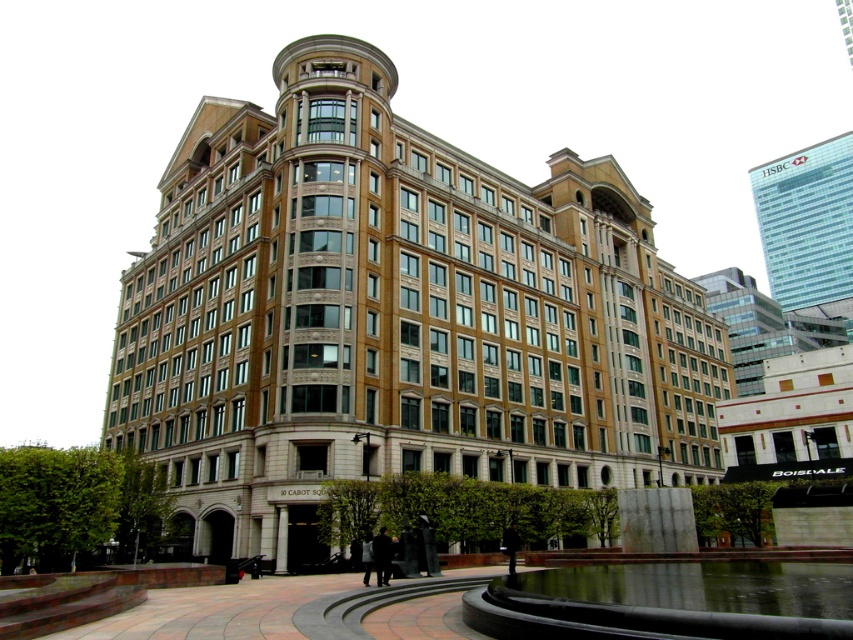
You are a drone operator who needs to fly a drone between the brown stone building at center and the glassy reflective skyscraper at upper right. The drone has a maximum flight distance of 150 meters. Can the drone safely fly between these two points without exceeding its range?

The brown stone building at center and glassy reflective skyscraper at upper right are 147.49 meters apart from each other. Since the drone has a maximum flight distance of 150 meters, it can safely fly between these two points without exceeding its range.

You are standing at the camera position and want to take a photo of the brown stone building at center. If your camera can focus on objects up to 50 meters away, will you be able to capture the building clearly?

The brown stone building at center and camera are 48.64 meters apart from each other. Since 48.64 meters is within the camera focus range of up to 50 meters, you can capture the building clearly.